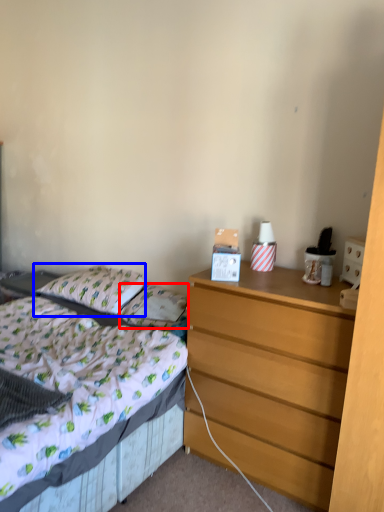
Question: Which object appears closest to the camera in this image, pillow (highlighted by a red box) or pillow (highlighted by a blue box)?

Choices:
 (A) pillow
 (B) pillow

Answer: (A)